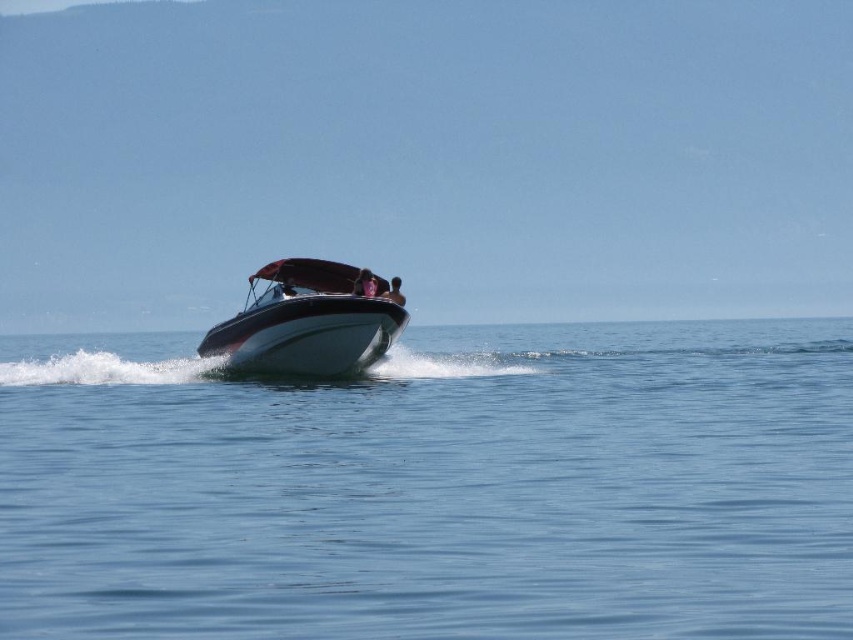
You are navigating a drone that needs to fly from point A to point B in the motorboat scene. The motorboat is moving forward. If point A is point (390, 570) and point B is point (347, 291), will the drone have to fly over the motorboat to reach point B?

Point (390, 570) is in front of point (347, 291), so the drone will have to fly over the motorboat to reach point B because point A is ahead of point B along the boat.